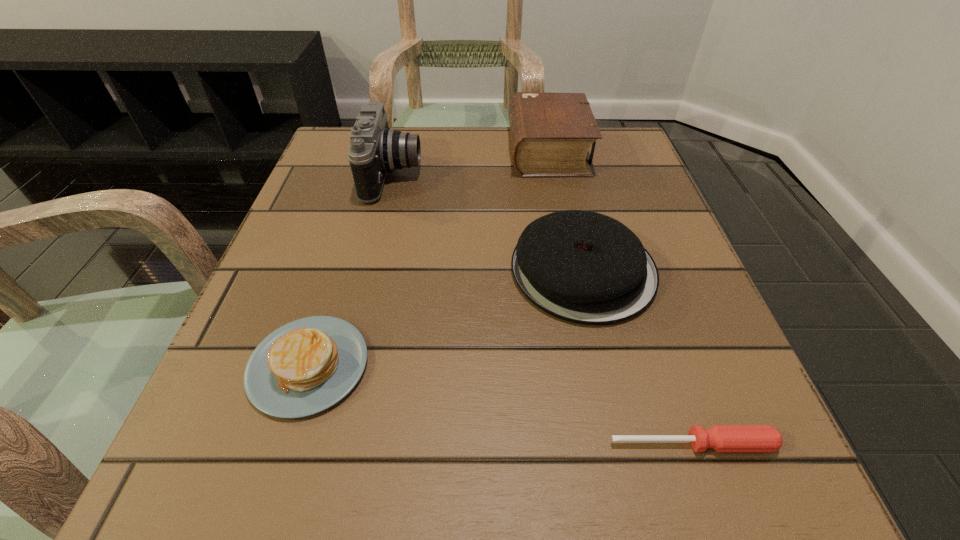
Select which object is the second closest to the fourth shortest object. Please provide its 2D coordinates. Your answer should be formatted as a tuple, i.e. [(x, y)], where the tuple contains the x and y coordinates of a point satisfying the conditions above.

[(375, 149)]

I want to click on vacant region that satisfies the following two spatial constraints: 1. on the front-facing side of the tallest object; 2. on the front side of the second shortest object, so click(347, 366).

Locate an element on the screen. vacant point that satisfies the following two spatial constraints: 1. on the spine side of the second tallest object; 2. on the back side of the screwdriver is located at coordinates (609, 443).

The image size is (960, 540). Find the location of `vacant region that satisfies the following two spatial constraints: 1. on the back side of the right pancake; 2. on the front-facing side of the camera`. vacant region that satisfies the following two spatial constraints: 1. on the back side of the right pancake; 2. on the front-facing side of the camera is located at coordinates (562, 175).

Image resolution: width=960 pixels, height=540 pixels. Find the location of `free space that satisfies the following two spatial constraints: 1. on the back side of the nearest object; 2. on the spine side of the second tallest object`. free space that satisfies the following two spatial constraints: 1. on the back side of the nearest object; 2. on the spine side of the second tallest object is located at coordinates (593, 151).

I want to click on vacant point that satisfies the following two spatial constraints: 1. on the back side of the screwdriver; 2. on the spine side of the fourth shortest object, so click(593, 151).

This screenshot has width=960, height=540. I want to click on vacant space that satisfies the following two spatial constraints: 1. on the front-facing side of the camera; 2. on the right side of the third shortest object, so click(371, 270).

The height and width of the screenshot is (540, 960). I want to click on free location that satisfies the following two spatial constraints: 1. on the back side of the shortest object; 2. on the spine side of the second tallest object, so click(593, 151).

The width and height of the screenshot is (960, 540). Identify the location of free spot that satisfies the following two spatial constraints: 1. on the spine side of the fourth shortest object; 2. on the left side of the third tallest object. (573, 270).